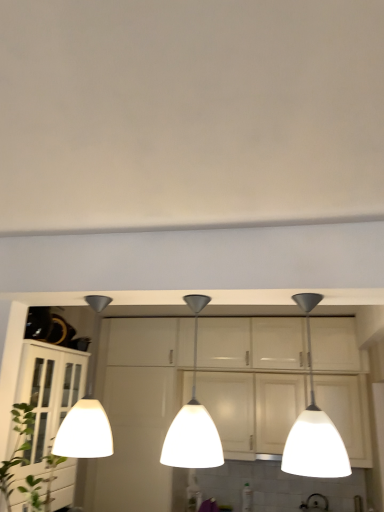
This screenshot has width=384, height=512. In order to click on vacant space situated above white glossy pendant light at left, which is the first lamp in left-to-right order (from a real-world perspective) in this screenshot , I will do click(x=105, y=298).